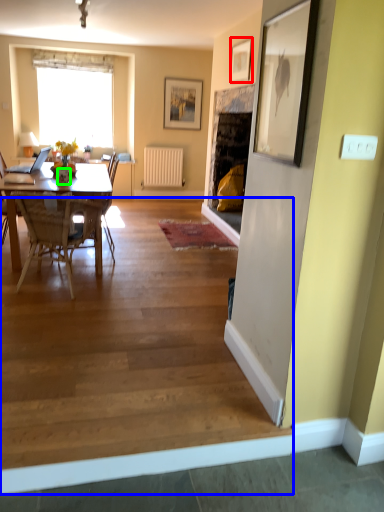
Question: Which is nearer to the picture frame (highlighted by a red box)? stair (highlighted by a blue box) or vase (highlighted by a green box).

Choices:
 (A) stair
 (B) vase

Answer: (B)